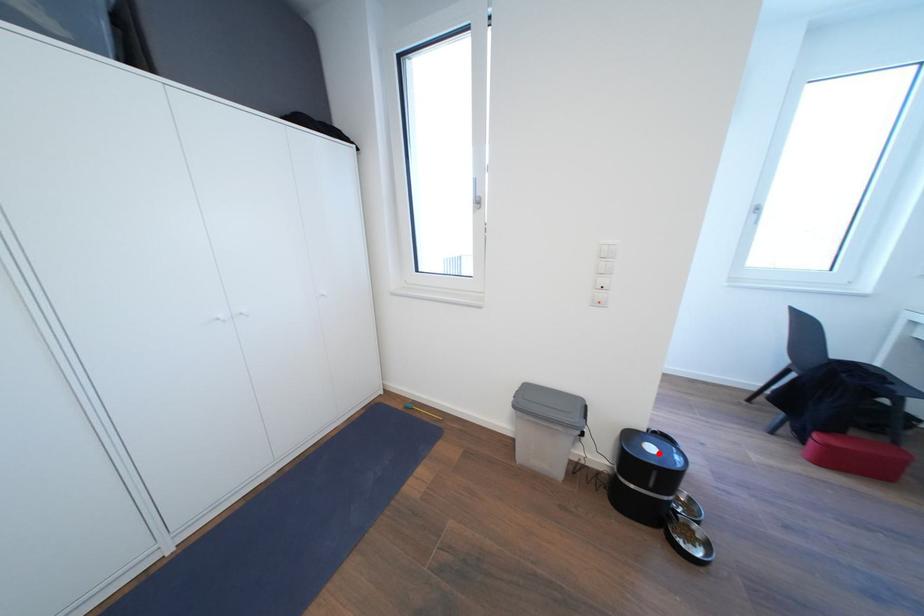
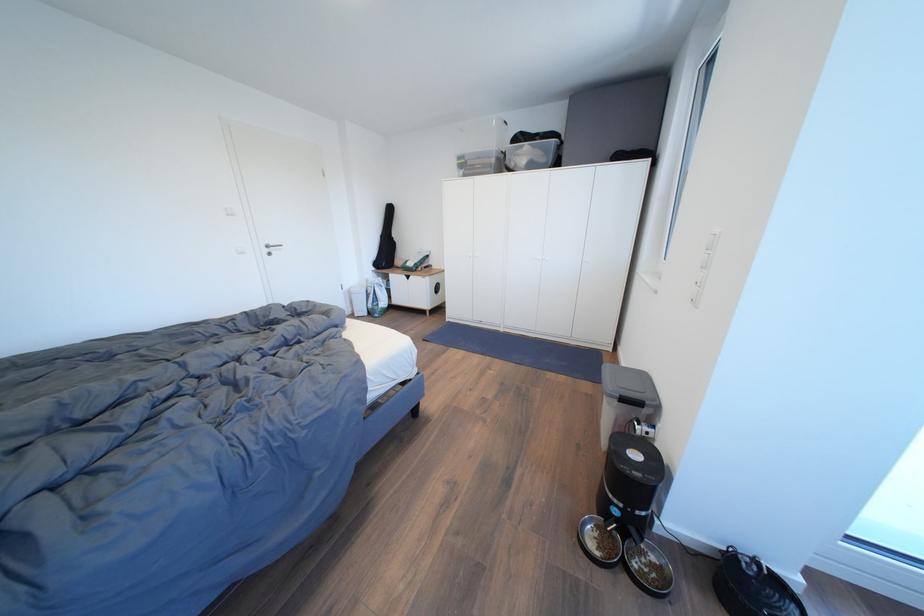
Find the pixel in the second image that matches the highlighted location in the first image.

(642, 460)